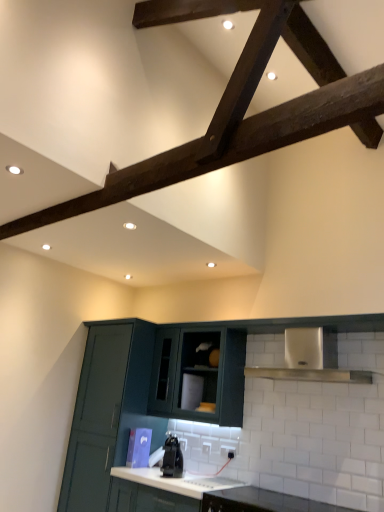
Question: Which direction should I rotate to look at white glossy countertop at lower center, the second countertop in the left-to-right sequence, — up or down?

Choices:
 (A) down
 (B) up

Answer: (A)

Question: From a real-world perspective, is white glossy countertop at lower center, the second countertop in the left-to-right sequence, positioned under matte dark green cabinet at center, the 3th cabinetry from the left, based on gravity?

Choices:
 (A) no
 (B) yes

Answer: (B)

Question: Is white glossy countertop at lower center, arranged as the 1th countertop when viewed from the right, not close to matte dark green cabinet at center, the 3th cabinetry from the left?

Choices:
 (A) yes
 (B) no

Answer: (B)

Question: Can you confirm if white glossy countertop at lower center, the second countertop in the left-to-right sequence, is shorter than matte dark green cabinet at center, the 1th cabinetry in the right-to-left sequence?

Choices:
 (A) no
 (B) yes

Answer: (B)

Question: Is white glossy countertop at lower center, arranged as the 1th countertop when viewed from the right, taller than matte dark green cabinet at center, the 3th cabinetry from the left?

Choices:
 (A) no
 (B) yes

Answer: (A)

Question: Is matte dark green cabinet at center, the 3th cabinetry from the left, at the back of white glossy countertop at lower center, the second countertop in the left-to-right sequence?

Choices:
 (A) no
 (B) yes

Answer: (A)

Question: Considering the relative sizes of white glossy countertop at lower center, arranged as the 1th countertop when viewed from the right, and matte dark green cabinet at center, the 3th cabinetry from the left, in the image provided, is white glossy countertop at lower center, arranged as the 1th countertop when viewed from the right, smaller than matte dark green cabinet at center, the 3th cabinetry from the left,?

Choices:
 (A) no
 (B) yes

Answer: (B)

Question: Is matte dark green cabinet at lower left, which ranks as the first cabinetry in left-to-right order, smaller than white glossy countertop at center, arranged as the second countertop when viewed from the right?

Choices:
 (A) yes
 (B) no

Answer: (B)

Question: Can you confirm if matte dark green cabinet at lower left, which ranks as the first cabinetry in left-to-right order, is thinner than white glossy countertop at center, the first countertop in the left-to-right sequence?

Choices:
 (A) no
 (B) yes

Answer: (B)

Question: Considering the relative sizes of matte dark green cabinet at lower left, which is the 3th cabinetry from right to left, and white glossy countertop at center, arranged as the second countertop when viewed from the right, in the image provided, is matte dark green cabinet at lower left, which is the 3th cabinetry from right to left, bigger than white glossy countertop at center, arranged as the second countertop when viewed from the right,?

Choices:
 (A) no
 (B) yes

Answer: (B)

Question: Considering the relative sizes of matte dark green cabinet at lower left, which ranks as the first cabinetry in left-to-right order, and white glossy countertop at center, arranged as the second countertop when viewed from the right, in the image provided, is matte dark green cabinet at lower left, which ranks as the first cabinetry in left-to-right order, wider than white glossy countertop at center, arranged as the second countertop when viewed from the right,?

Choices:
 (A) no
 (B) yes

Answer: (A)

Question: Considering the relative positions of matte dark green cabinet at lower left, which is the 3th cabinetry from right to left, and white glossy countertop at center, the first countertop in the left-to-right sequence, in the image provided, is matte dark green cabinet at lower left, which is the 3th cabinetry from right to left, to the left of white glossy countertop at center, the first countertop in the left-to-right sequence, from the viewer's perspective?

Choices:
 (A) yes
 (B) no

Answer: (A)

Question: Could you tell me if matte dark green cabinet at lower left, which ranks as the first cabinetry in left-to-right order, is turned towards white glossy countertop at center, arranged as the second countertop when viewed from the right?

Choices:
 (A) yes
 (B) no

Answer: (B)

Question: From the image's perspective, would you say black glossy kettle at center is shown under matte dark green cabinet at center, which is the second cabinetry in right-to-left order?

Choices:
 (A) no
 (B) yes

Answer: (B)